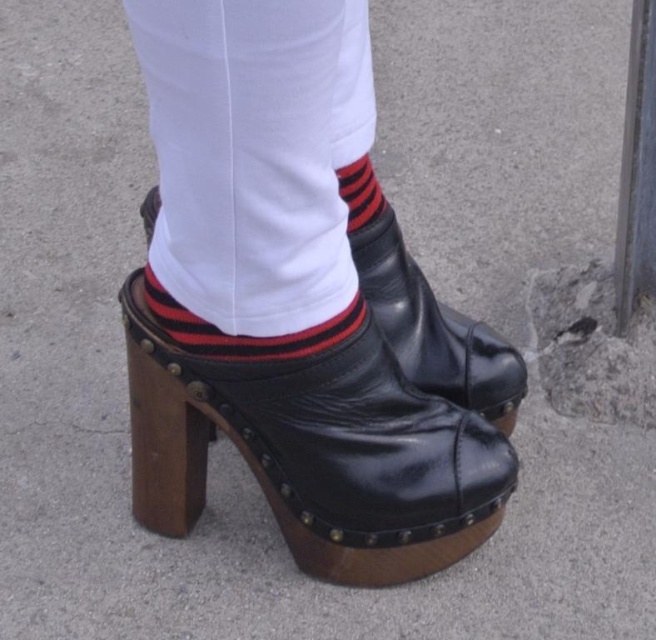
You are trying to put on your shoes but you notice both the black leather clog at center and the striped cotton sock at center. Which one should you put on first according to their sizes?

The striped cotton sock at center should be put on first because it is smaller than the black leather clog at center.

You are a shoemaker measuring the space between two footwear items in the image. The black leather clog at center and the shiny black boot at center are placed side by side. Can you confirm if there is enough space between them to fit a 18 cm ruler without overlapping?

The distance between the black leather clog at center and the shiny black boot at center is 17.98 centimeters. Since the ruler is 18 cm long, it would not fit entirely between them without overlapping as the space is slightly shorter.

You are standing in front of the image and want to place a sticker exactly at the center of the black leather clog at center. According to the coordinates provided, where should you place the sticker?

The sticker should be placed at the coordinates point (316, 451), which is the exact position of the black leather clog at center.